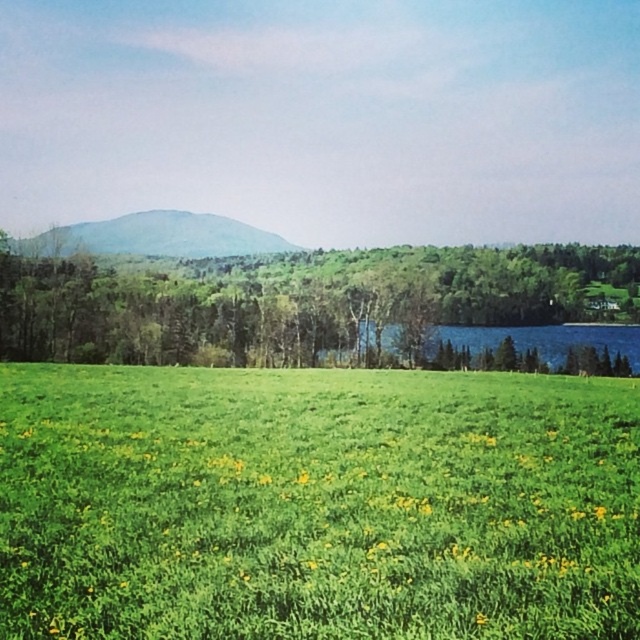
Question: Based on their relative distances, which object is nearer to the green leafy tree at center?

Choices:
 (A) green grassy hillside at upper center
 (B) green grassy field at center

Answer: (A)

Question: Which point is farther to the camera?

Choices:
 (A) (292, 550)
 (B) (304, 355)

Answer: (B)

Question: Can you confirm if green grassy field at center is wider than green leafy tree at center?

Choices:
 (A) yes
 (B) no

Answer: (B)

Question: Is green grassy field at center positioned behind green leafy tree at center?

Choices:
 (A) no
 (B) yes

Answer: (A)

Question: Which point appears farthest from the camera in this image?

Choices:
 (A) (429, 540)
 (B) (90, 244)
 (C) (400, 246)

Answer: (C)

Question: Does green grassy field at center appear on the right side of green leafy tree at center?

Choices:
 (A) no
 (B) yes

Answer: (A)